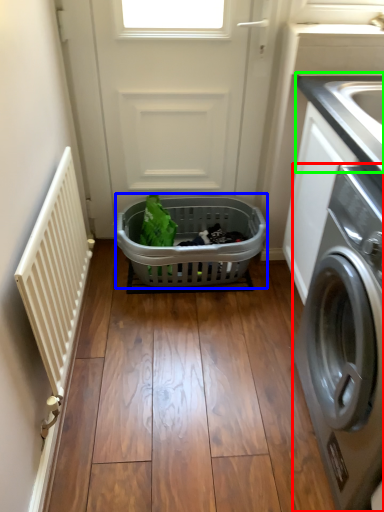
Question: Based on their relative distances, which object is farther from washing machine (highlighted by a red box)? Choose from basket (highlighted by a blue box) and counter top (highlighted by a green box).

Choices:
 (A) basket
 (B) counter top

Answer: (A)